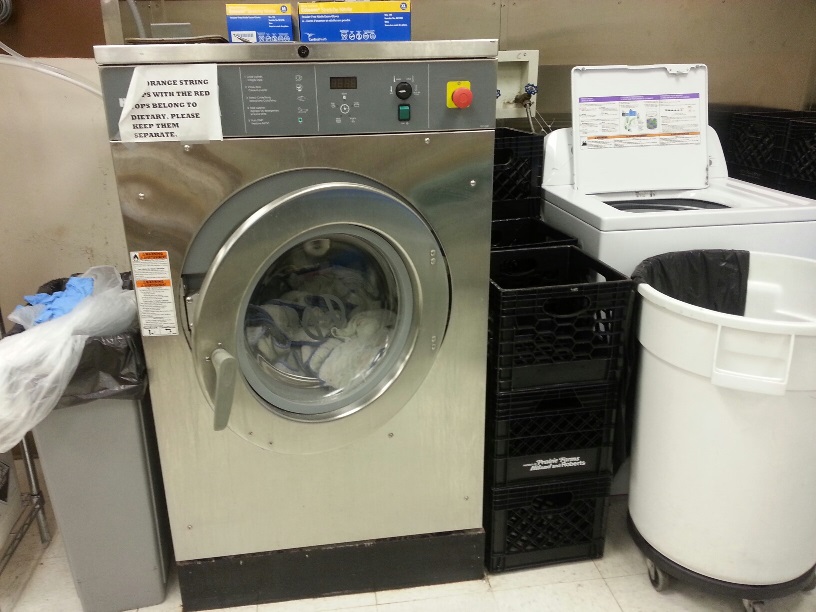
Where is `gray trash can`? This screenshot has width=816, height=612. gray trash can is located at coordinates click(87, 472).